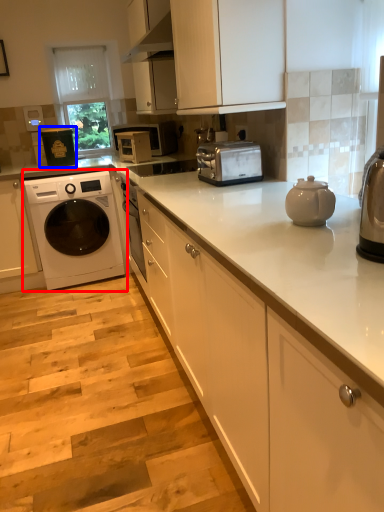
Question: Which point is closer to the camera, washing machine (highlighted by a red box) or appliance (highlighted by a blue box)?

Choices:
 (A) washing machine
 (B) appliance

Answer: (A)